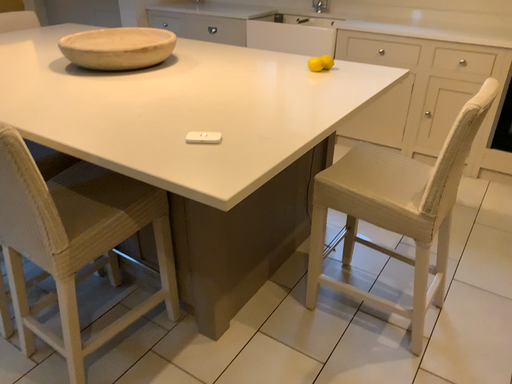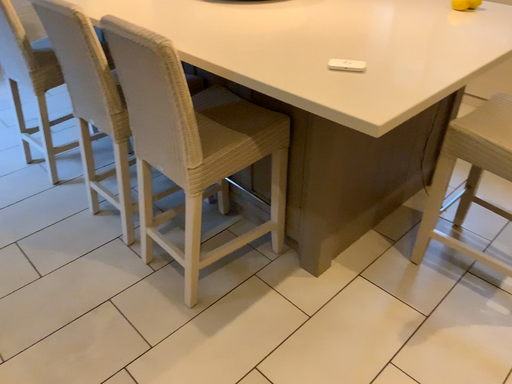
Question: Which way did the camera rotate in the video?

Choices:
 (A) rotated left
 (B) rotated right

Answer: (A)